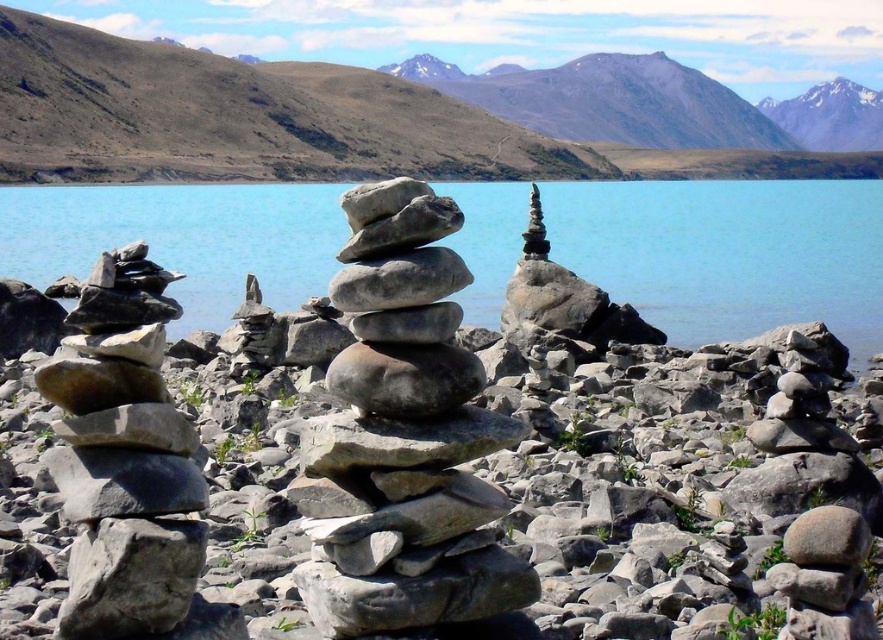
Question: Which point is closer to the camera?

Choices:
 (A) blue smooth water at center
 (B) snowy granite mountain at upper right

Answer: (A)

Question: Which of these objects is positioned closest to the gray stone stack at center?

Choices:
 (A) gray rock formation at center
 (B) snowy granite mountain at upper right
 (C) gray rock mountain at upper center
 (D) blue smooth water at center

Answer: (D)

Question: Considering the real-world distances, which object is farthest from the gray rock formation at center?

Choices:
 (A) gray stone stack at left
 (B) gray rock mountain at upper center

Answer: (A)

Question: Does gray rock formation at center appear over gray rock mountain at upper center?

Choices:
 (A) yes
 (B) no

Answer: (B)

Question: Is gray stone stack at left above snowy granite mountain at upper right?

Choices:
 (A) no
 (B) yes

Answer: (A)

Question: From the image, what is the correct spatial relationship of gray stone stack at left in relation to snowy granite mountain at upper right?

Choices:
 (A) left
 (B) right

Answer: (A)